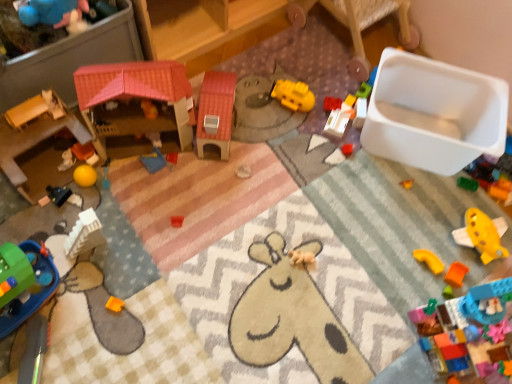
Where is `vacant area that lies between yellow matte plastic arch at lower right, acting as the 4th toy starting from the right, and green plastic toy at lower left, acting as the second toy starting from the left`? vacant area that lies between yellow matte plastic arch at lower right, acting as the 4th toy starting from the right, and green plastic toy at lower left, acting as the second toy starting from the left is located at coordinates (230, 280).